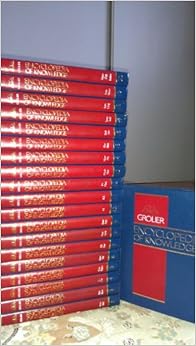
The height and width of the screenshot is (346, 196). I want to click on white wall, so click(162, 160).